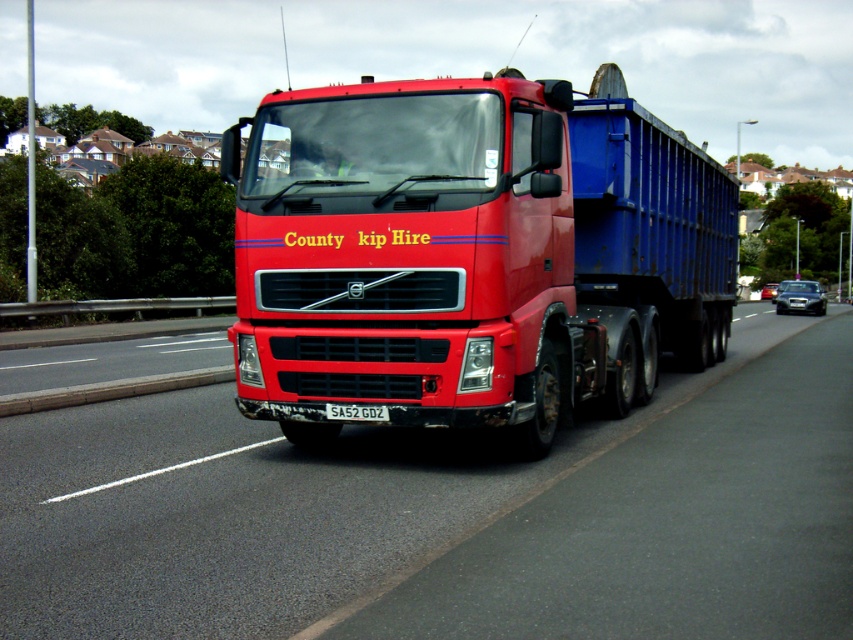
Is shiny red truck at center thinner than white plastic license plate at center?

In fact, shiny red truck at center might be wider than white plastic license plate at center.

Is point (471, 385) farther from camera compared to point (351, 417)?

No.

At what (x,y) coordinates should I click in order to perform the action: click on shiny red truck at center. Please return your answer as a coordinate pair (x, y). This screenshot has height=640, width=853. Looking at the image, I should click on (471, 253).

Does metallic asphalt highway at center have a greater height compared to shiny red truck at center?

In fact, metallic asphalt highway at center may be shorter than shiny red truck at center.

Does point (236, 596) lie in front of point (674, 339)?

That is True.

Find the location of a particular element. metallic asphalt highway at center is located at coordinates (450, 515).

Which is above, metallic asphalt highway at center or white plastic license plate at center?

white plastic license plate at center is above.

Which of these two, metallic asphalt highway at center or white plastic license plate at center, stands shorter?

Standing shorter between the two is white plastic license plate at center.

Who is more distant from viewer, (39, 460) or (339, 410)?

Positioned behind is point (39, 460).

Locate an element on the screen. The height and width of the screenshot is (640, 853). metallic asphalt highway at center is located at coordinates (450, 515).